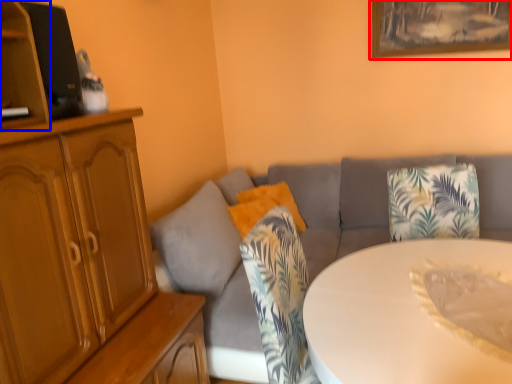
Question: Among these objects, which one is farthest to the camera, picture frame (highlighted by a red box) or shelf (highlighted by a blue box)?

Choices:
 (A) picture frame
 (B) shelf

Answer: (A)